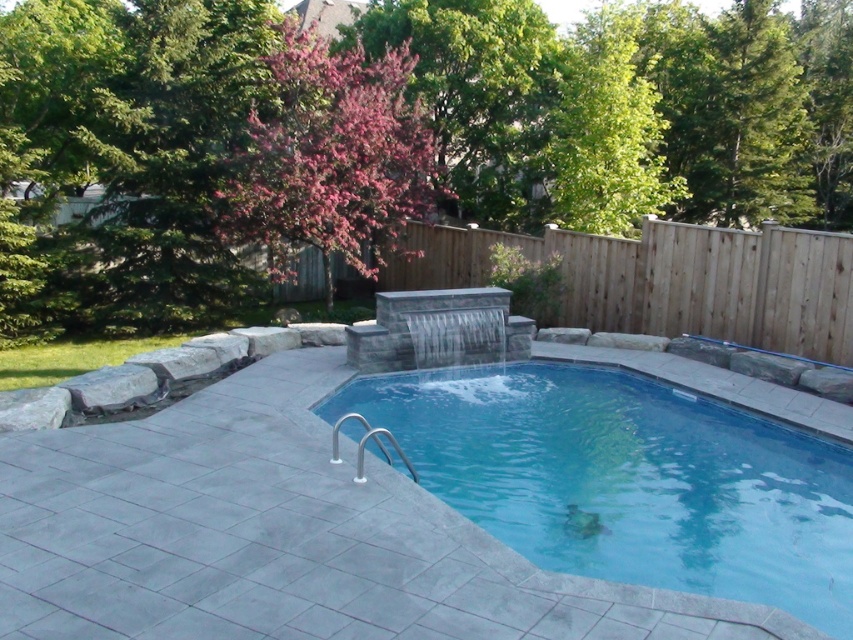
Question: Can you confirm if pink flowering tree at upper center is positioned above blue smooth pool at center?

Choices:
 (A) yes
 (B) no

Answer: (A)

Question: Which object appears closest to the camera in this image?

Choices:
 (A) blue smooth pool at center
 (B) pink flowering tree at upper center
 (C) pink blossoms at upper center

Answer: (A)

Question: Is pink flowering tree at upper center below blue smooth pool at center?

Choices:
 (A) no
 (B) yes

Answer: (A)

Question: Which object is positioned closest to the wooden fence at upper center?

Choices:
 (A) blue smooth pool at center
 (B) pink flowering tree at upper center

Answer: (A)

Question: Can you confirm if blue smooth pool at center is wider than wooden fence at upper center?

Choices:
 (A) yes
 (B) no

Answer: (A)

Question: Based on their relative distances, which object is nearer to the blue smooth pool at center?

Choices:
 (A) wooden fence at upper center
 (B) pink flowering tree at upper center
 (C) pink blossoms at upper center

Answer: (C)